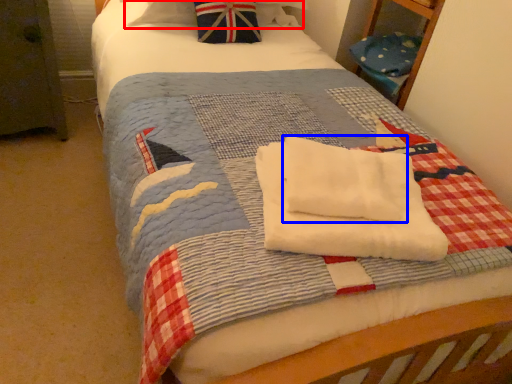
Question: Which object is closer to the camera taking this photo, pillow (highlighted by a red box) or beach towel (highlighted by a blue box)?

Choices:
 (A) pillow
 (B) beach towel

Answer: (B)